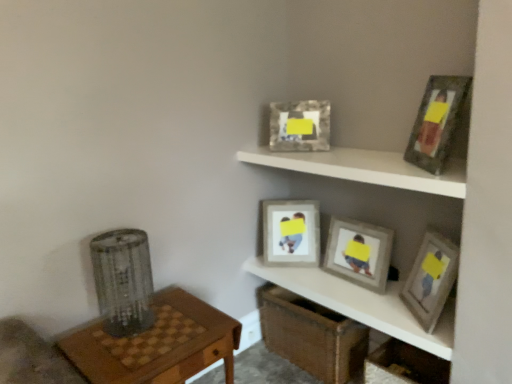
Question: Is matte gray picture frame at center, the 3th picture frame when ordered from front to back, not inside matte gray picture frame at upper right, which appears as the fourth picture frame when viewed from the back?

Choices:
 (A) yes
 (B) no

Answer: (A)

Question: Is matte gray picture frame at center, the 3th picture frame when ordered from front to back, beside matte gray picture frame at upper right, which is the 2th picture frame in front-to-back order?

Choices:
 (A) no
 (B) yes

Answer: (A)

Question: From a real-world perspective, is matte gray picture frame at center, which is the 3th picture frame in back-to-front order, beneath matte gray picture frame at upper right, which is the 2th picture frame in front-to-back order?

Choices:
 (A) yes
 (B) no

Answer: (A)

Question: From the image's perspective, is matte gray picture frame at center, the 3th picture frame when ordered from front to back, over matte gray picture frame at upper right, which appears as the fourth picture frame when viewed from the back?

Choices:
 (A) no
 (B) yes

Answer: (B)

Question: Considering the relative positions of matte gray picture frame at center, the 3th picture frame when ordered from front to back, and matte gray picture frame at upper right, which is the 2th picture frame in front-to-back order, in the image provided, is matte gray picture frame at center, the 3th picture frame when ordered from front to back, in front of matte gray picture frame at upper right, which is the 2th picture frame in front-to-back order,?

Choices:
 (A) no
 (B) yes

Answer: (A)

Question: Can you confirm if matte gray picture frame at center, which is the 3th picture frame in back-to-front order, is shorter than matte gray picture frame at upper right, which is the 2th picture frame in front-to-back order?

Choices:
 (A) no
 (B) yes

Answer: (A)

Question: Is matte gray picture frame at center, which is the 3th picture frame in back-to-front order, taller than metallic silver picture frame at upper center, acting as the 2th picture frame starting from the back?

Choices:
 (A) yes
 (B) no

Answer: (A)

Question: Does matte gray picture frame at center, which is the 3th picture frame in back-to-front order, have a greater width compared to metallic silver picture frame at upper center, acting as the 2th picture frame starting from the back?

Choices:
 (A) no
 (B) yes

Answer: (B)

Question: Is matte gray picture frame at center, which is the 3th picture frame in back-to-front order, with metallic silver picture frame at upper center, the fourth picture frame in the front-to-back sequence?

Choices:
 (A) no
 (B) yes

Answer: (A)

Question: Does matte gray picture frame at center, the 3th picture frame when ordered from front to back, contain metallic silver picture frame at upper center, the fourth picture frame in the front-to-back sequence?

Choices:
 (A) no
 (B) yes

Answer: (A)

Question: Is matte gray picture frame at center, the 3th picture frame when ordered from front to back, smaller than metallic silver picture frame at upper center, the fourth picture frame in the front-to-back sequence?

Choices:
 (A) no
 (B) yes

Answer: (A)

Question: Is the depth of matte gray picture frame at center, the 3th picture frame when ordered from front to back, less than that of metallic silver picture frame at upper center, the fourth picture frame in the front-to-back sequence?

Choices:
 (A) no
 (B) yes

Answer: (B)

Question: Is wooden picture frame at upper right, arranged as the 1th picture frame when viewed from the front, a part of white matte shelf at upper center, placed as the 1th shelf when sorted from top to bottom?

Choices:
 (A) no
 (B) yes

Answer: (A)